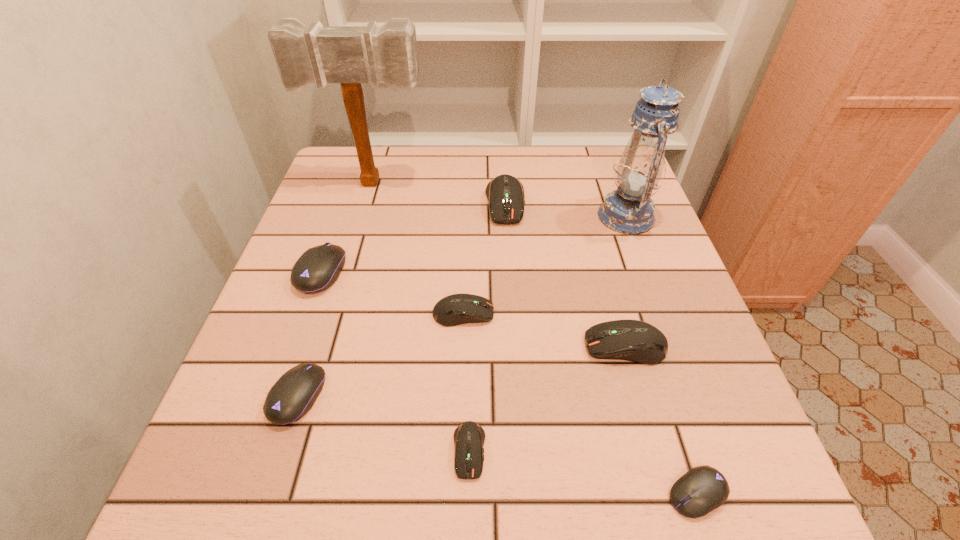
The width and height of the screenshot is (960, 540). I want to click on the second biggest black computer mouse, so click(293, 395).

The image size is (960, 540). I want to click on the nearest dark computer equipment, so click(x=469, y=437).

Where is `the nearest black computer mouse`? The height and width of the screenshot is (540, 960). the nearest black computer mouse is located at coordinates (702, 489).

I want to click on the smallest black computer mouse, so click(702, 489).

I want to click on vacant point located on the back of the wood mallet, so click(382, 153).

Where is `vacant space located on the front-facing side of the second tallest object`? The height and width of the screenshot is (540, 960). vacant space located on the front-facing side of the second tallest object is located at coordinates (524, 217).

You are a GUI agent. You are given a task and a screenshot of the screen. Output one action in this format:
    pyautogui.click(x=<x>, y=<y>)
    Task: Click on the free region located on the front-facing side of the second tallest object
    
    Given the screenshot: What is the action you would take?
    pyautogui.click(x=537, y=217)

At what (x,y) coordinates should I click in order to perform the action: click on vacant space located on the front-facing side of the second tallest object. Please return your answer as a coordinate pair (x, y). This screenshot has width=960, height=540. Looking at the image, I should click on (508, 217).

You are a GUI agent. You are given a task and a screenshot of the screen. Output one action in this format:
    pyautogui.click(x=<x>, y=<y>)
    Task: Click on the free region located 0.280m on the button of the biggest dark computer equipment
    
    Given the screenshot: What is the action you would take?
    pyautogui.click(x=513, y=319)

The height and width of the screenshot is (540, 960). I want to click on blank space located 0.210m on the button of the third farthest dark computer equipment, so click(x=470, y=346).